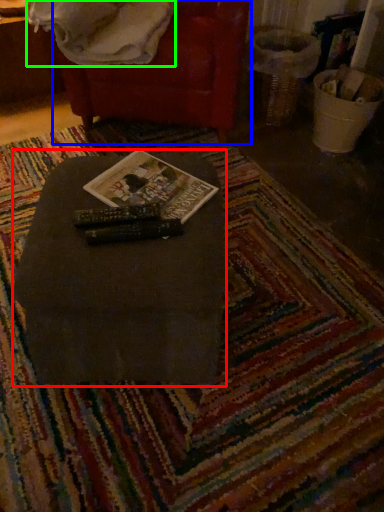
Question: Which is nearer to the table (highlighted by a red box)? bean bag chair (highlighted by a blue box) or blanket (highlighted by a green box).

Choices:
 (A) bean bag chair
 (B) blanket

Answer: (A)